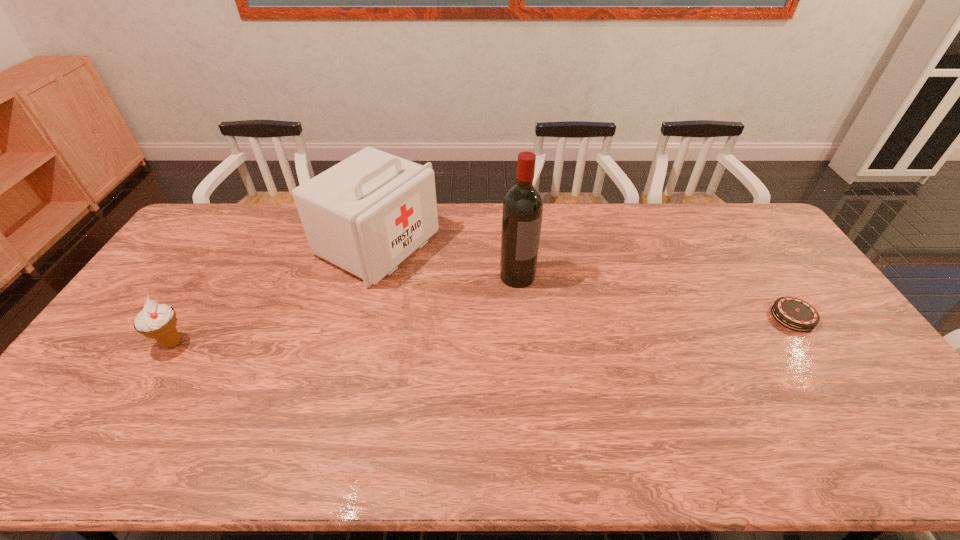
In the image, there is a desktop. Where is `vacant space at the near edge`? vacant space at the near edge is located at coordinates (837, 420).

Find the location of a particular element. The width and height of the screenshot is (960, 540). free space at the left edge of the desktop is located at coordinates (108, 346).

This screenshot has width=960, height=540. What are the coordinates of `blank space at the right edge of the desktop` in the screenshot? It's located at (814, 306).

Locate an element on the screen. vacant space at the far left corner is located at coordinates (216, 221).

The width and height of the screenshot is (960, 540). I want to click on free spot between the first-aid kit and the rightmost object, so click(x=586, y=281).

At what (x,y) coordinates should I click in order to perform the action: click on vacant space in between the first-aid kit and the rightmost object. Please return your answer as a coordinate pair (x, y). The height and width of the screenshot is (540, 960). Looking at the image, I should click on (586, 281).

At what (x,y) coordinates should I click in order to perform the action: click on free space between the shortest object and the third shortest object. Please return your answer as a coordinate pair (x, y). This screenshot has width=960, height=540. Looking at the image, I should click on (586, 281).

Locate an element on the screen. The height and width of the screenshot is (540, 960). vacant area that lies between the icecream and the tallest object is located at coordinates (346, 309).

Find the location of a particular element. This screenshot has width=960, height=540. blank region between the wine bottle and the third tallest object is located at coordinates (346, 309).

In order to click on free spot between the tallest object and the icecream in this screenshot , I will do `click(346, 309)`.